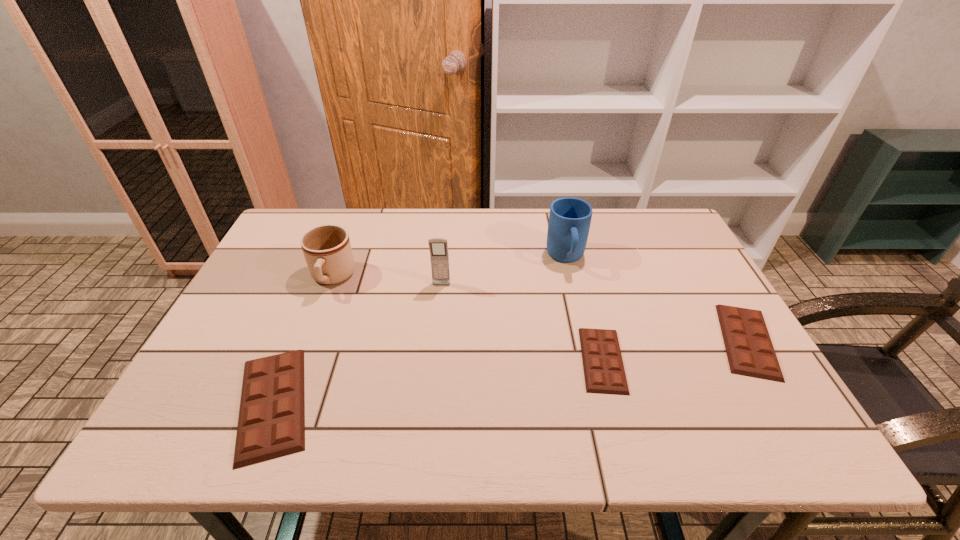
The image size is (960, 540). I want to click on free region located on the back of the shortest object, so click(589, 312).

The width and height of the screenshot is (960, 540). In order to click on vacant region located 0.170m on the back of the second shortest object in this screenshot , I will do `click(702, 265)`.

Identify the location of vacant space located 0.330m on the side of the left mug with the handle. This screenshot has width=960, height=540. (283, 406).

Locate an element on the screen. vacant region located on the side of the taller mug with the handle is located at coordinates (594, 379).

Locate an element on the screen. This screenshot has height=540, width=960. free region located on the front-facing side of the fourth object from right to left is located at coordinates (438, 317).

Where is `object that is at the far edge`? The width and height of the screenshot is (960, 540). object that is at the far edge is located at coordinates (569, 222).

At what (x,y) coordinates should I click in order to perform the action: click on object situated at the left edge. Please return your answer as a coordinate pair (x, y). The width and height of the screenshot is (960, 540). Looking at the image, I should click on (271, 424).

I want to click on object present at the right edge, so click(x=750, y=352).

Locate an element on the screen. Image resolution: width=960 pixels, height=540 pixels. object that is at the near left corner is located at coordinates (271, 424).

The image size is (960, 540). I want to click on object present at the near right corner, so click(x=750, y=352).